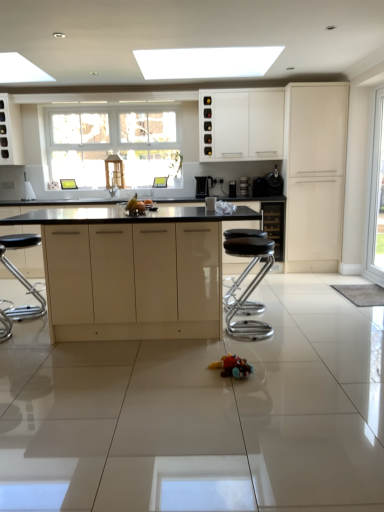
Question: Is transparent glass door at right oriented away from white glossy cabinet at upper center, which appears as the 2th cabinetry when viewed from the back?

Choices:
 (A) yes
 (B) no

Answer: (B)

Question: Can you confirm if transparent glass door at right is smaller than white glossy cabinet at upper center, the third cabinetry positioned from the front?

Choices:
 (A) no
 (B) yes

Answer: (B)

Question: Is transparent glass door at right facing towards white glossy cabinet at upper center, acting as the 3th cabinetry starting from the right?

Choices:
 (A) no
 (B) yes

Answer: (A)

Question: From the image's perspective, is transparent glass door at right below white glossy cabinet at upper center, the third cabinetry positioned from the front?

Choices:
 (A) yes
 (B) no

Answer: (A)

Question: Is transparent glass door at right with white glossy cabinet at upper center, acting as the 3th cabinetry starting from the right?

Choices:
 (A) yes
 (B) no

Answer: (B)

Question: Is transparent glass door at right not close to white glossy cabinet at upper center, the second cabinetry in the left-to-right sequence?

Choices:
 (A) yes
 (B) no

Answer: (A)

Question: Are black plastic coffee maker at center, the first appliance positioned from the left, and black glossy coffee machine at center, marked as the 3th appliance in a left-to-right arrangement, making contact?

Choices:
 (A) no
 (B) yes

Answer: (A)

Question: Does black plastic coffee maker at center, which is counted as the 4th appliance, starting from the right, appear on the left side of black glossy coffee machine at center, the 2th appliance when ordered from right to left?

Choices:
 (A) yes
 (B) no

Answer: (A)

Question: Considering the relative sizes of black plastic coffee maker at center, which is counted as the 4th appliance, starting from the right, and black glossy coffee machine at center, the 2th appliance when ordered from right to left, in the image provided, is black plastic coffee maker at center, which is counted as the 4th appliance, starting from the right, thinner than black glossy coffee machine at center, the 2th appliance when ordered from right to left,?

Choices:
 (A) no
 (B) yes

Answer: (B)

Question: From a real-world perspective, is black plastic coffee maker at center, which is counted as the 4th appliance, starting from the right, physically above black glossy coffee machine at center, the 2th appliance when ordered from right to left?

Choices:
 (A) no
 (B) yes

Answer: (A)

Question: Could you tell me if black plastic coffee maker at center, which is counted as the 4th appliance, starting from the right, is facing black glossy coffee machine at center, marked as the 3th appliance in a left-to-right arrangement?

Choices:
 (A) yes
 (B) no

Answer: (B)

Question: Considering the relative sizes of black plastic coffee maker at center, the first appliance positioned from the left, and black glossy coffee machine at center, marked as the 3th appliance in a left-to-right arrangement, in the image provided, is black plastic coffee maker at center, the first appliance positioned from the left, smaller than black glossy coffee machine at center, marked as the 3th appliance in a left-to-right arrangement,?

Choices:
 (A) no
 (B) yes

Answer: (B)

Question: Is black glossy coffee machine at center, the 2th appliance when ordered from right to left, at the left side of metallic silver coffee machine at center, positioned as the second appliance in left-to-right order?

Choices:
 (A) no
 (B) yes

Answer: (A)